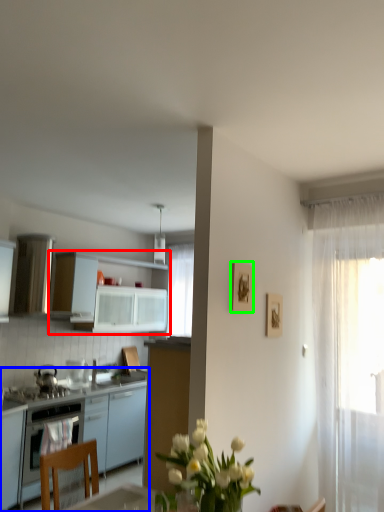
Question: Which is nearer to the cabinetry (highlighted by a red box)? cabinetry (highlighted by a blue box) or picture frame (highlighted by a green box).

Choices:
 (A) cabinetry
 (B) picture frame

Answer: (A)